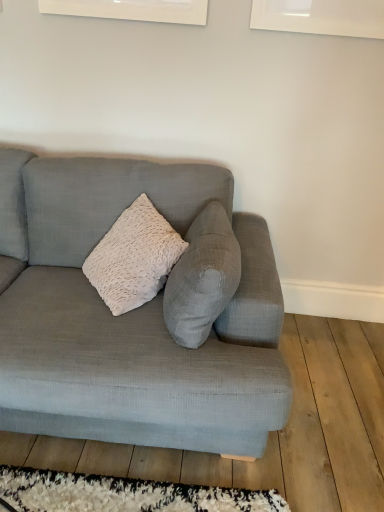
Question: Considering the relative sizes of textured gray couch at center and white shaggy rug at lower center in the image provided, is textured gray couch at center taller than white shaggy rug at lower center?

Choices:
 (A) no
 (B) yes

Answer: (B)

Question: Considering the relative positions of textured gray couch at center and white shaggy rug at lower center in the image provided, is textured gray couch at center behind white shaggy rug at lower center?

Choices:
 (A) no
 (B) yes

Answer: (A)

Question: From a real-world perspective, is textured gray couch at center physically above white shaggy rug at lower center?

Choices:
 (A) no
 (B) yes

Answer: (B)

Question: Is textured gray couch at center oriented towards white shaggy rug at lower center?

Choices:
 (A) no
 (B) yes

Answer: (B)

Question: From the image's perspective, is textured gray couch at center located beneath white shaggy rug at lower center?

Choices:
 (A) no
 (B) yes

Answer: (A)

Question: Does textured gray couch at center appear on the right side of white shaggy rug at lower center?

Choices:
 (A) yes
 (B) no

Answer: (B)

Question: Can you confirm if white shaggy rug at lower center is taller than textured gray couch at center?

Choices:
 (A) yes
 (B) no

Answer: (B)

Question: Is the depth of white shaggy rug at lower center less than that of textured gray couch at center?

Choices:
 (A) no
 (B) yes

Answer: (A)

Question: Is white shaggy rug at lower center not inside textured gray couch at center?

Choices:
 (A) no
 (B) yes

Answer: (B)

Question: Is white shaggy rug at lower center touching textured gray couch at center?

Choices:
 (A) yes
 (B) no

Answer: (B)

Question: Is white shaggy rug at lower center wider than textured gray couch at center?

Choices:
 (A) yes
 (B) no

Answer: (B)

Question: Can you confirm if white shaggy rug at lower center is thinner than textured gray couch at center?

Choices:
 (A) yes
 (B) no

Answer: (A)

Question: Considering the positions of textured gray couch at center and white shaggy rug at lower center in the image, is textured gray couch at center wider or thinner than white shaggy rug at lower center?

Choices:
 (A) wide
 (B) thin

Answer: (A)